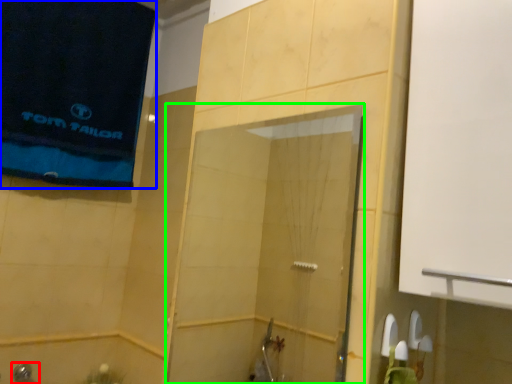
Question: Which object is the farthest from shower (highlighted by a red box)? Choose among these: beach towel (highlighted by a blue box) or screen door (highlighted by a green box).

Choices:
 (A) beach towel
 (B) screen door

Answer: (B)